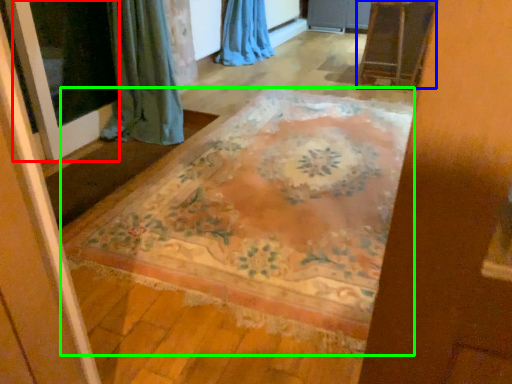
Question: Considering the real-world distances, which object is closest to screen door (highlighted by a red box)? furniture (highlighted by a blue box) or mat (highlighted by a green box).

Choices:
 (A) furniture
 (B) mat

Answer: (B)